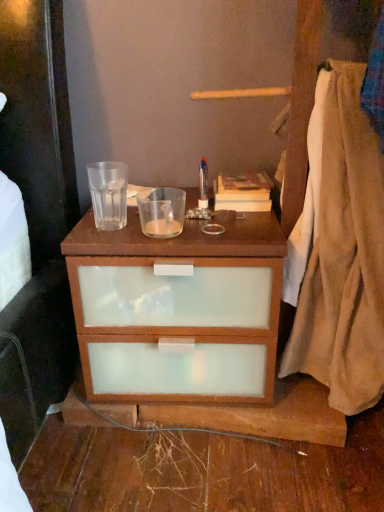
Measure the distance between beige cotton blanket at right and camera.

beige cotton blanket at right and camera are 31.12 inches apart.

Where is `beige cotton blanket at right`? The image size is (384, 512). beige cotton blanket at right is located at coordinates (339, 250).

The height and width of the screenshot is (512, 384). What do you see at coordinates (339, 250) in the screenshot? I see `beige cotton blanket at right` at bounding box center [339, 250].

In the scene shown: Measure the distance between point (354, 263) and camera.

Point (354, 263) is 34.96 inches away from camera.

At what (x,y) coordinates should I click in order to perform the action: click on hardcover book at upper right. Please return your answer as a coordinate pair (x, y). This screenshot has width=384, height=512. Looking at the image, I should click on [243, 192].

What do you see at coordinates (243, 192) in the screenshot?
I see `hardcover book at upper right` at bounding box center [243, 192].

Image resolution: width=384 pixels, height=512 pixels. I want to click on beige cotton blanket at right, so click(x=339, y=250).

Is beige cotton blanket at right at the left side of hardcover book at upper right?

No.

In the scene shown: In the image, is beige cotton blanket at right positioned in front of or behind hardcover book at upper right?

beige cotton blanket at right is in front of hardcover book at upper right.

Between point (339, 266) and point (246, 179), which one is positioned behind?

The point (246, 179) is behind.

From the image's perspective, is beige cotton blanket at right beneath hardcover book at upper right?

Yes, from the image's perspective, beige cotton blanket at right is below hardcover book at upper right.

In the scene shown: From a real-world perspective, between beige cotton blanket at right and hardcover book at upper right, who is vertically higher?

From a 3D spatial view, beige cotton blanket at right is above.

Considering the sizes of objects beige cotton blanket at right and hardcover book at upper right in the image provided, who is wider, beige cotton blanket at right or hardcover book at upper right?

With larger width is beige cotton blanket at right.

Based on the photo, is beige cotton blanket at right taller than hardcover book at upper right?

Correct, beige cotton blanket at right is much taller as hardcover book at upper right.

Considering the sizes of objects beige cotton blanket at right and hardcover book at upper right in the image provided, who is smaller, beige cotton blanket at right or hardcover book at upper right?

hardcover book at upper right.

Based on the photo, is beige cotton blanket at right completely or partially outside of hardcover book at upper right?

That's correct, beige cotton blanket at right is outside of hardcover book at upper right.

Are beige cotton blanket at right and hardcover book at upper right making contact?

beige cotton blanket at right and hardcover book at upper right are not in contact.

Is beige cotton blanket at right looking in the opposite direction of hardcover book at upper right?

That's not correct — beige cotton blanket at right is not looking away from hardcover book at upper right.

Where is `book above the beige cotton blanket at right (from the image's perspective)`? This screenshot has height=512, width=384. book above the beige cotton blanket at right (from the image's perspective) is located at coordinates (243, 192).

Considering the relative positions of hardcover book at upper right and beige cotton blanket at right in the image provided, is hardcover book at upper right to the left of beige cotton blanket at right from the viewer's perspective?

Yes.

Which object is closer to the camera taking this photo, hardcover book at upper right or beige cotton blanket at right?

beige cotton blanket at right.

Considering the points (235, 195) and (324, 199), which point is in front, point (235, 195) or point (324, 199)?

The point (324, 199) is more forward.

From the image's perspective, which one is positioned lower, hardcover book at upper right or beige cotton blanket at right?

beige cotton blanket at right appears lower in the image.

From a real-world perspective, is hardcover book at upper right on top of beige cotton blanket at right?

Actually, hardcover book at upper right is physically below beige cotton blanket at right in the real world.

Considering the sizes of objects hardcover book at upper right and beige cotton blanket at right in the image provided, who is thinner, hardcover book at upper right or beige cotton blanket at right?

hardcover book at upper right.

Can you confirm if hardcover book at upper right is shorter than beige cotton blanket at right?

Yes, hardcover book at upper right is shorter than beige cotton blanket at right.

Who is bigger, hardcover book at upper right or beige cotton blanket at right?

Bigger between the two is beige cotton blanket at right.

Is beige cotton blanket at right completely or partially inside hardcover book at upper right?

No, beige cotton blanket at right is not a part of hardcover book at upper right.

Are hardcover book at upper right and beige cotton blanket at right far apart?

No, there isn't a large distance between hardcover book at upper right and beige cotton blanket at right.

Does hardcover book at upper right turn towards beige cotton blanket at right?

No, hardcover book at upper right is not facing towards beige cotton blanket at right.

How different are the orientations of hardcover book at upper right and beige cotton blanket at right in degrees?

The angular difference between hardcover book at upper right and beige cotton blanket at right is 1.09 degrees.

Measure the distance from hardcover book at upper right to beige cotton blanket at right.

They are 9.78 inches apart.

Identify the location of blanket on the right side of hardcover book at upper right. This screenshot has height=512, width=384. (339, 250).

The width and height of the screenshot is (384, 512). I want to click on blanket to the right of hardcover book at upper right, so click(339, 250).

Locate an element on the screen. The height and width of the screenshot is (512, 384). book above the beige cotton blanket at right (from the image's perspective) is located at coordinates (243, 192).